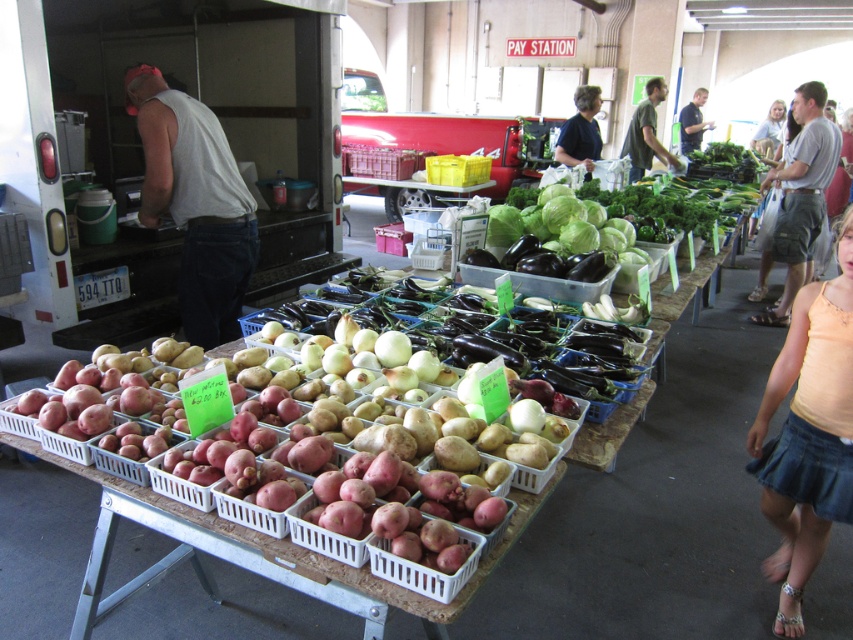
Question: Is orange cotton tank top at lower right below gray cotton t-shirt at upper right?

Choices:
 (A) no
 (B) yes

Answer: (B)

Question: Which of the following is the closest to the observer?

Choices:
 (A) dark gray shirt at center
 (B) green leafy lettuce at center

Answer: (B)

Question: Which of the following is the closest to the observer?

Choices:
 (A) white tank top at center
 (B) gray cotton t-shirt at upper right
 (C) green matte shirt at upper right

Answer: (A)

Question: Estimate the real-world distances between objects in this image. Which object is farther from the green leafy lettuce at center?

Choices:
 (A) green matte shirt at upper right
 (B) orange cotton tank top at lower right

Answer: (A)

Question: Can you confirm if gray cotton t-shirt at upper right is smaller than dark blue shirt at center?

Choices:
 (A) yes
 (B) no

Answer: (B)

Question: Does white tank top at center have a smaller size compared to dark blue shirt at center?

Choices:
 (A) no
 (B) yes

Answer: (B)